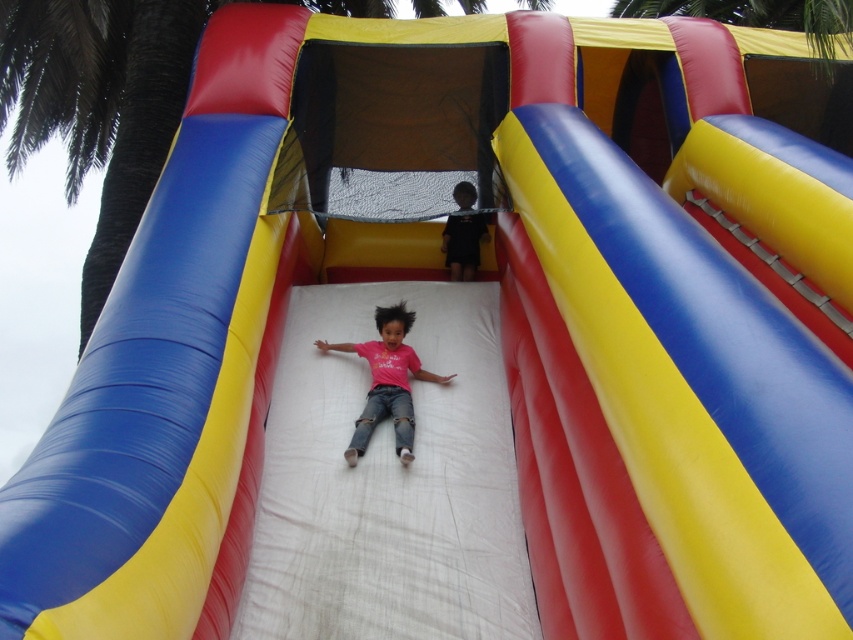
Describe the element at coordinates (387, 381) in the screenshot. The height and width of the screenshot is (640, 853). I see `pink matte shirt at center` at that location.

Is point (450, 374) positioned before point (456, 280)?

Yes, it is.

Find the location of a particular element. pink matte shirt at center is located at coordinates (387, 381).